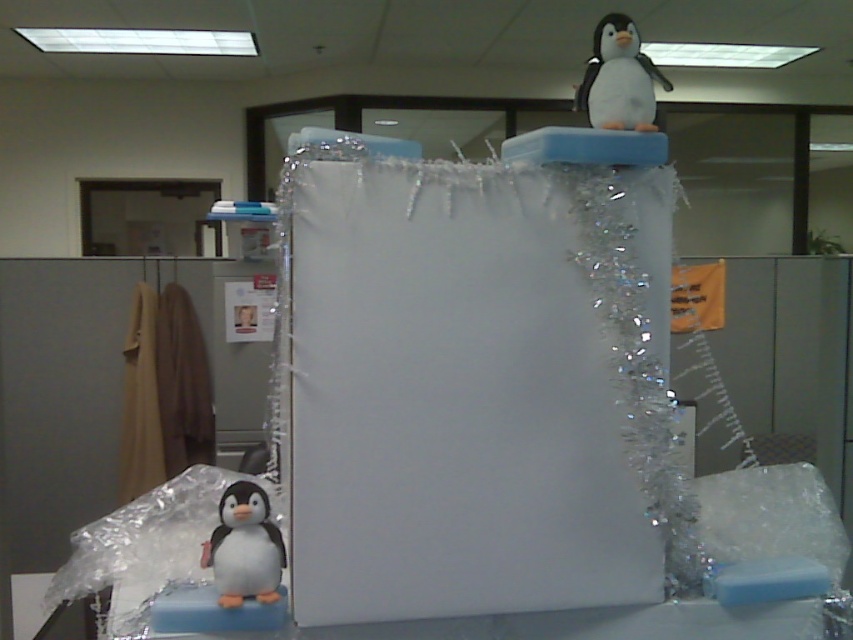
Is white matte penguin at lower left below white plush penguin at upper center?

Correct, white matte penguin at lower left is located below white plush penguin at upper center.

Is white matte penguin at lower left wider than white plush penguin at upper center?

In fact, white matte penguin at lower left might be narrower than white plush penguin at upper center.

Looking at this image, who is more forward, [225,566] or [608,68]?

Point [225,566] is more forward.

Image resolution: width=853 pixels, height=640 pixels. Identify the location of white matte penguin at lower left. (244, 547).